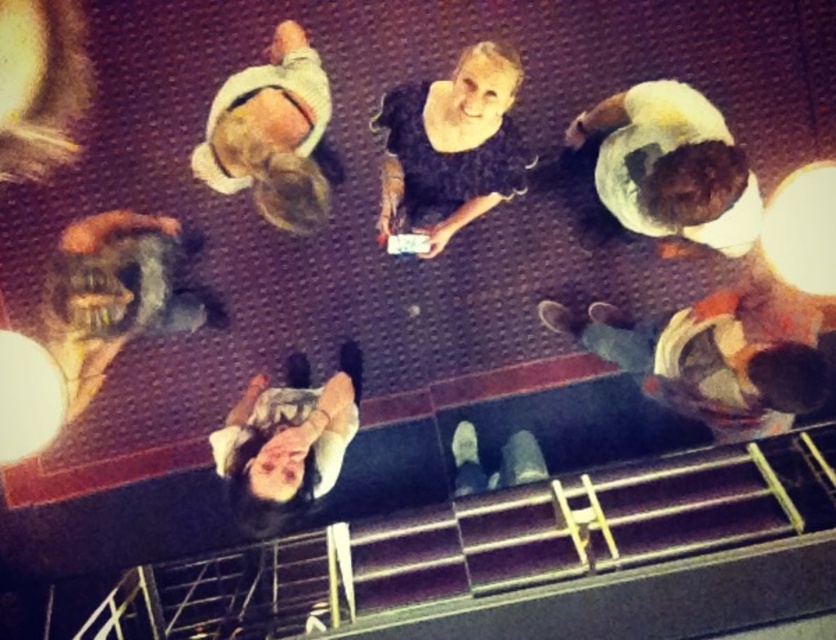
In the scene shown: Between white cotton shirt at upper right and shiny metallic helmet at left, which one appears on the left side from the viewer's perspective?

Positioned to the left is shiny metallic helmet at left.

Which is below, white cotton shirt at upper right or shiny metallic helmet at left?

shiny metallic helmet at left is lower down.

Measure the distance between point (650, 125) and camera.

Point (650, 125) and camera are 3.41 meters apart from each other.

Identify the location of white cotton shirt at upper right. The image size is (836, 640). (671, 166).

Is orange fabric shirt at right positioned before black velvet dress at center?

No.

In the scene shown: Can you confirm if orange fabric shirt at right is smaller than black velvet dress at center?

No.

Which is behind, point (666, 328) or point (460, 128)?

Point (666, 328)

The image size is (836, 640). I want to click on orange fabric shirt at right, so click(702, 364).

Which is above, smooth black stairs at lower center or shiny metallic helmet at left?

shiny metallic helmet at left

Who is more distant from viewer, (x=299, y=616) or (x=90, y=232)?

Point (x=299, y=616)

Between point (511, 602) and point (186, 332), which one is positioned behind?

The point (186, 332) is more distant.

Identify the location of smooth black stairs at lower center. (488, 547).